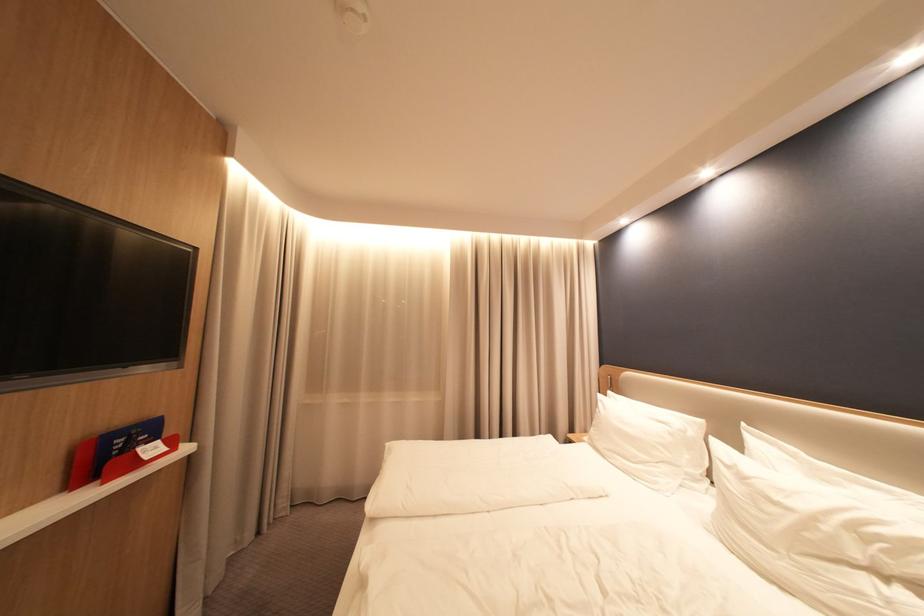
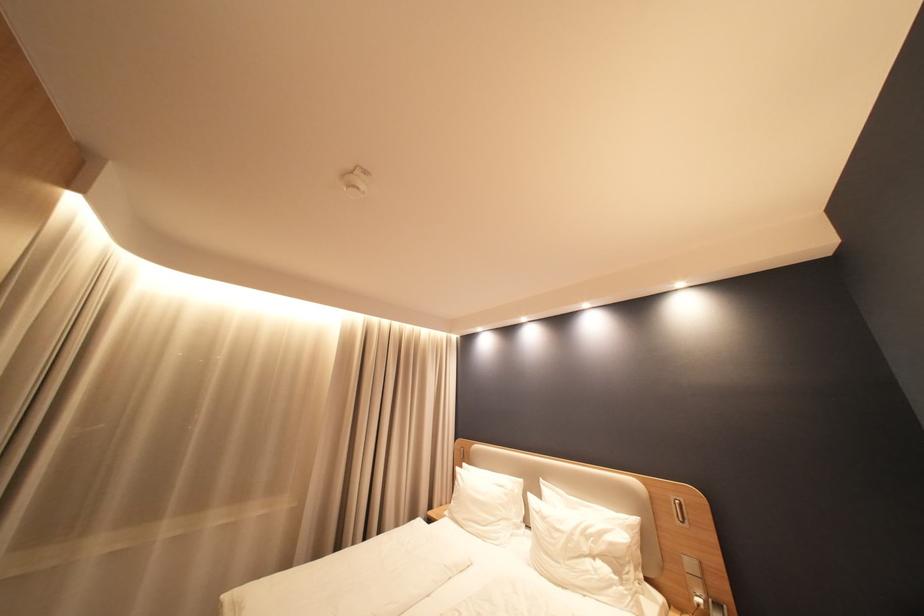
In the second image, find the point that corresponds to pixel 737 464 in the first image.

(546, 511)